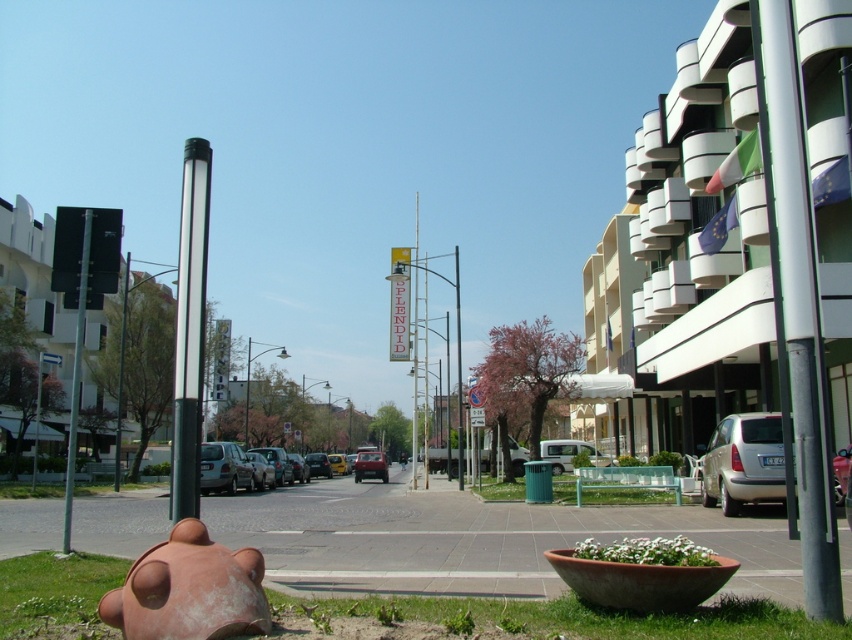
You are standing on the sidewalk and see the polished metal pole at center and the matte silver car at center. Which object is closer to you?

The polished metal pole at center is closer to you because it is in front of the matte silver car at center.

You are a delivery person trying to park your vehicle, which is the size of the matte silver car at center. There is a parking spot next to the polished metal pole at center. Can your vehicle fit there without touching the pole?

The polished metal pole at center occupies less space than the matte silver car at center. Since the pole takes up less space than your vehicle, there should be enough room to park without touching it.